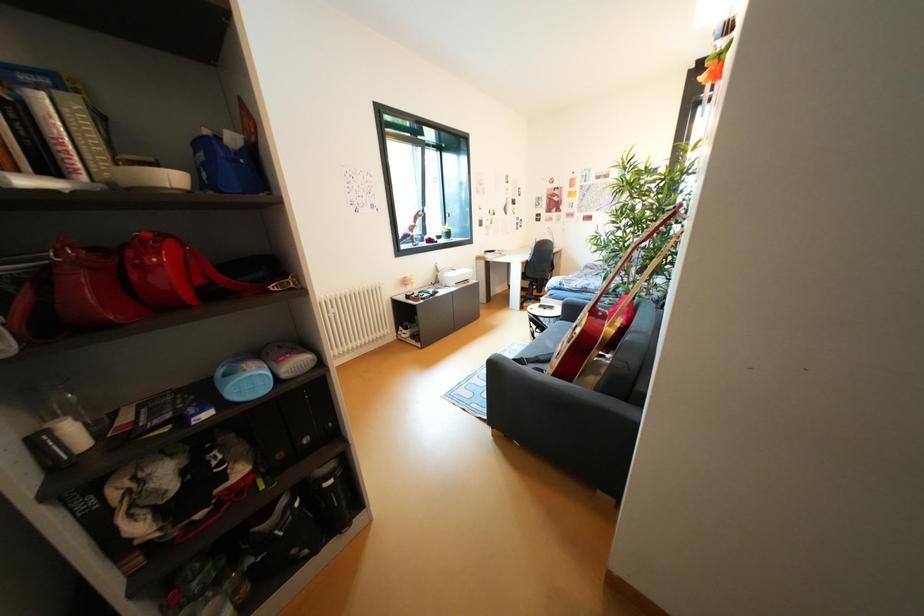
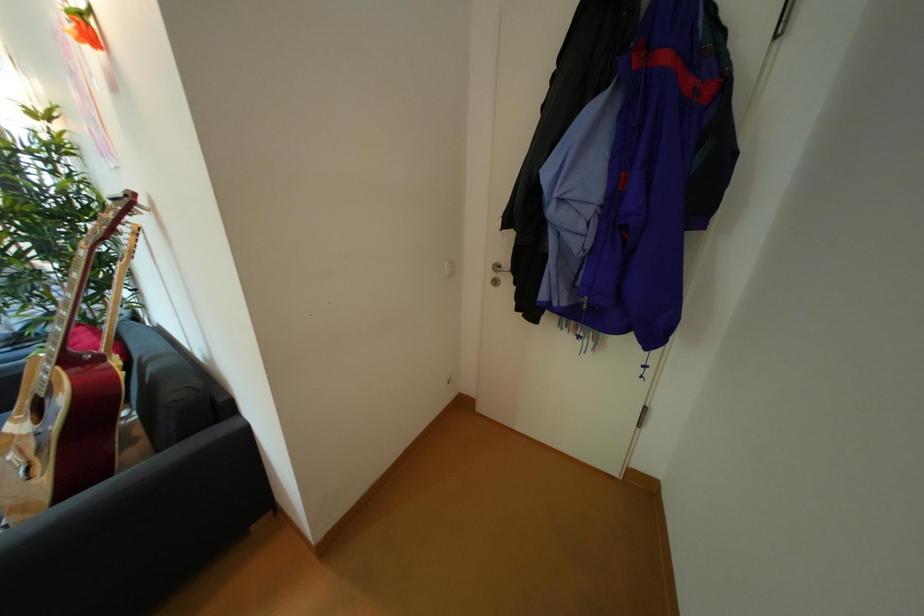
The images are taken continuously from a first-person perspective. In which direction is your viewpoint rotating?

The camera's rotation is toward right-down.